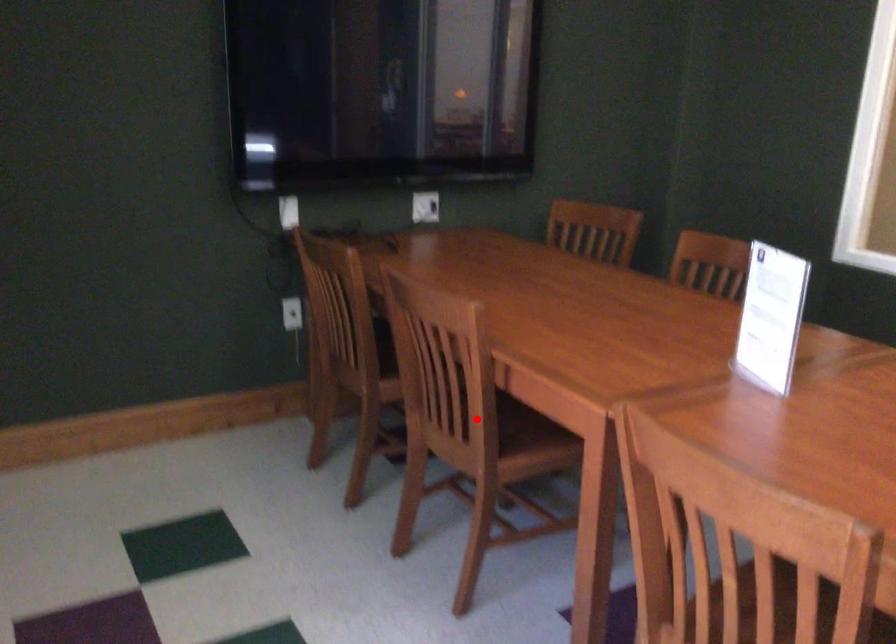
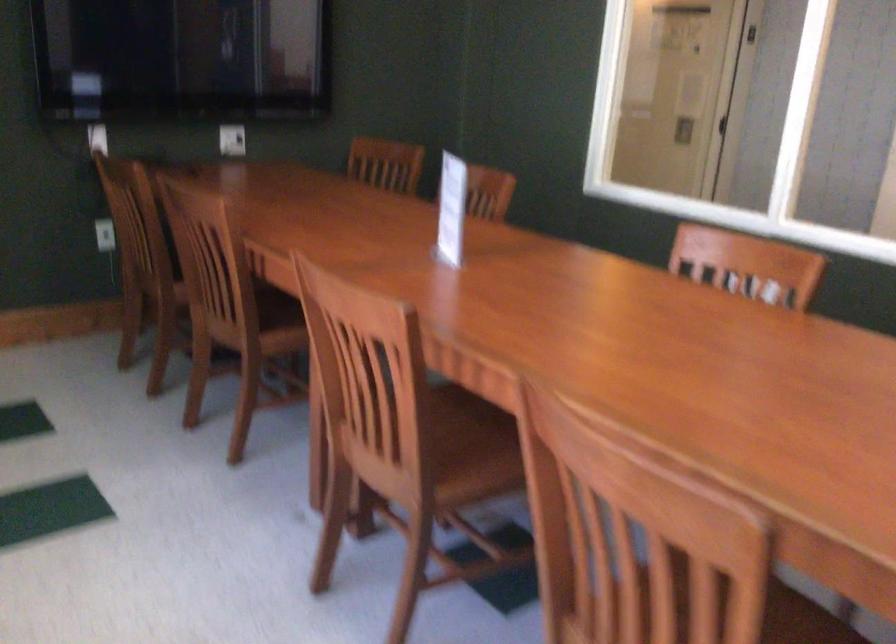
Question: A red point is marked in image1. In image2, is the corresponding 3D point closer to the camera or farther? Reply with the corresponding letter.

Choices:
 (A) The corresponding 3D point is closer.
 (B) The corresponding 3D point is farther.

Answer: (B)